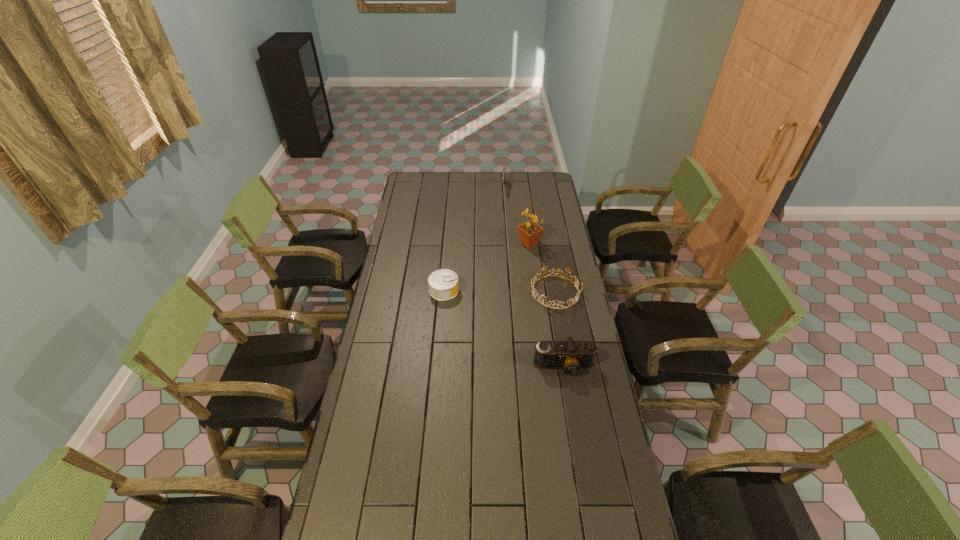
In order to click on tiara that is at the right edge in this screenshot , I will do `click(534, 294)`.

The width and height of the screenshot is (960, 540). Identify the location of sunflower at the right edge. pos(530,233).

The width and height of the screenshot is (960, 540). I want to click on vacant space at the far edge, so click(x=458, y=183).

In order to click on free region at the near edge of the desktop in this screenshot , I will do `click(505, 522)`.

Locate an element on the screen. vacant region at the left edge of the desktop is located at coordinates (389, 356).

This screenshot has width=960, height=540. In the image, there is a desktop. Find the location of `blank space at the right edge`. blank space at the right edge is located at coordinates (607, 408).

Identify the location of free space at the near left corner of the desktop. The height and width of the screenshot is (540, 960). (328, 537).

Locate an element on the screen. empty location between the tallest object and the pistol is located at coordinates pyautogui.click(x=516, y=215).

Locate an element on the screen. Image resolution: width=960 pixels, height=540 pixels. free spot between the leftmost object and the pistol is located at coordinates (473, 239).

Find the location of a particular element. The image size is (960, 540). vacant area between the leftmost object and the tiara is located at coordinates (499, 291).